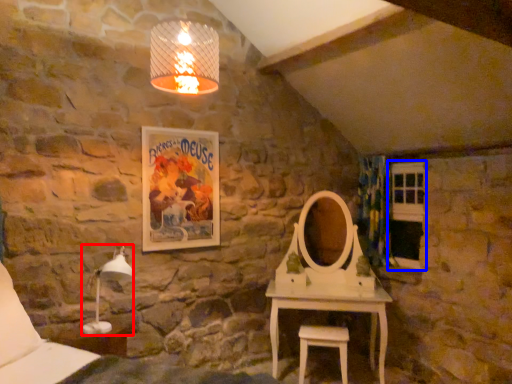
Question: Among these objects, which one is farthest to the camera, table lamp (highlighted by a red box) or window (highlighted by a blue box)?

Choices:
 (A) table lamp
 (B) window

Answer: (B)